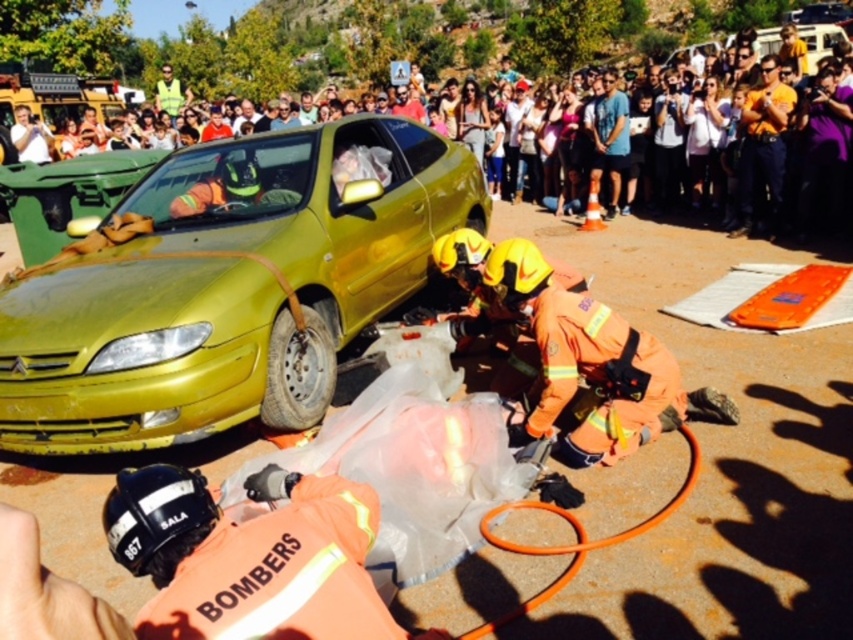
Question: Which point is closer to the camera?

Choices:
 (A) (648, 49)
 (B) (109, 310)

Answer: (B)

Question: Does metallic yellow car at left have a larger size compared to matte yellow car at center?

Choices:
 (A) no
 (B) yes

Answer: (A)

Question: Which point is closer to the camera?

Choices:
 (A) (281, 54)
 (B) (177, 298)

Answer: (B)

Question: Is metallic yellow car at left closer to the viewer compared to matte yellow car at center?

Choices:
 (A) no
 (B) yes

Answer: (B)

Question: Which object appears farthest from the camera in this image?

Choices:
 (A) matte yellow car at center
 (B) metallic yellow car at left

Answer: (A)

Question: Does metallic yellow car at left have a larger size compared to matte yellow car at center?

Choices:
 (A) no
 (B) yes

Answer: (A)